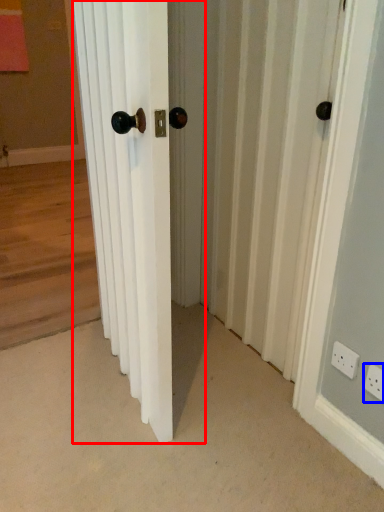
Question: Which of the following is the closest to the observer, door (highlighted by a red box) or electric outlet (highlighted by a blue box)?

Choices:
 (A) door
 (B) electric outlet

Answer: (A)